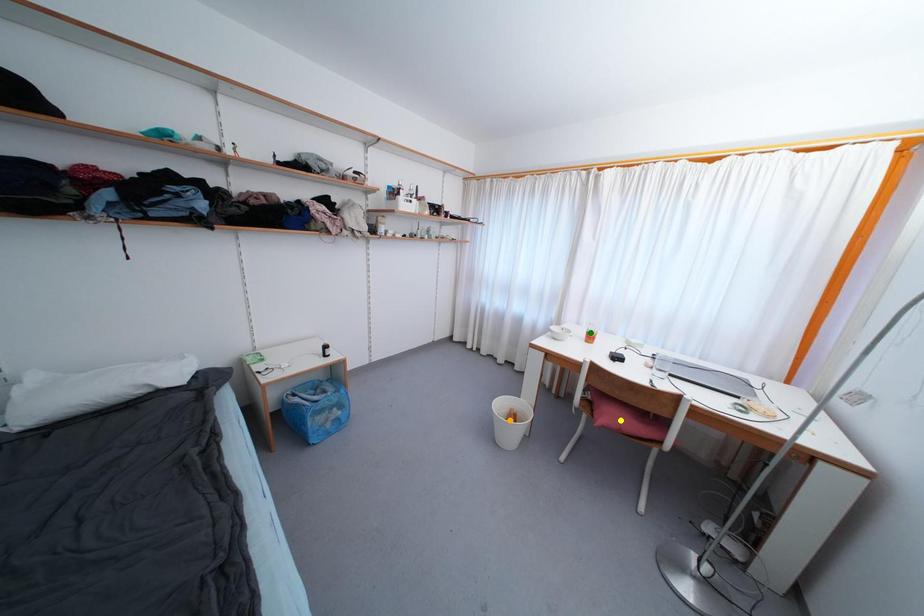
Order these from nearest to farthest:
yellow point
green point
orange point

yellow point, orange point, green point